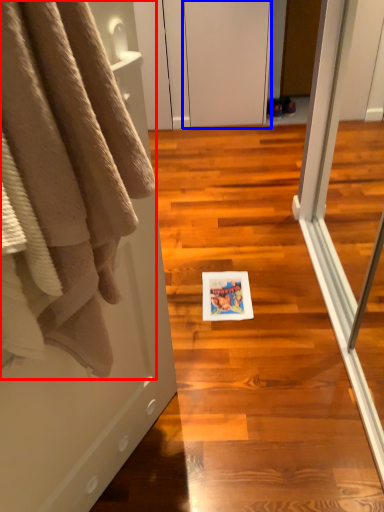
Question: Which of the following is the closest to the observer, towel (highlighted by a red box) or screen door (highlighted by a blue box)?

Choices:
 (A) towel
 (B) screen door

Answer: (A)